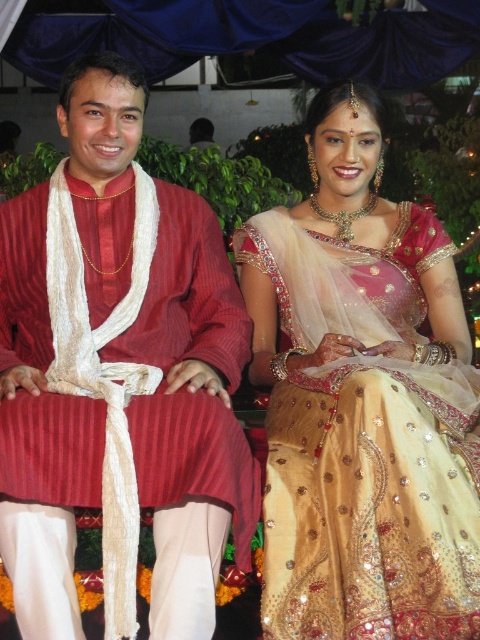
You are a photographer setting up a shoot in a studio. You have two props to place in the center of the frame. The matte red fabric at center and the golden silk saree at center. According to the scene description, which prop should you choose if you want to fill the frame more effectively?

The golden silk saree at center should be chosen because it occupies more space than the matte red fabric at center, making it better for filling the frame effectively.

You are a photographer at a cultural event and need to position two subjects so that their outfits are clearly visible. The subjects are wearing the matte red fabric at center and the golden silk saree at center. Based on their current positions, which subject should you move to ensure both outfits are fully visible in the frame?

The matte red fabric at center is to the left of the golden silk saree at center. To ensure both outfits are fully visible, you should move the subject wearing the golden silk saree at center slightly to the right, creating space between them and allowing both outfits to be captured clearly in the frame.

You are an event photographer at a cultural ceremony. You need to capture a closeup of the matte red fabric at center and golden silk saree at center. Which one is positioned higher in the image?

The matte red fabric at center is above the golden silk saree at center, so it is positioned higher in the image.